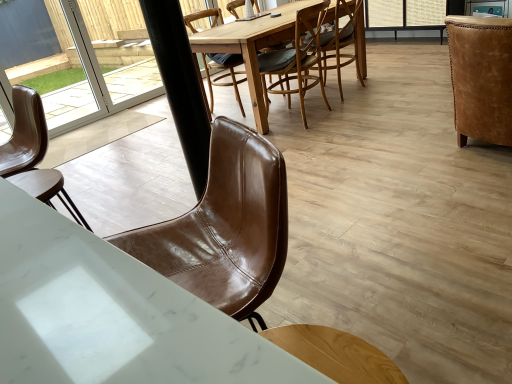
What is the approximate width of leather armchair at right, placed as the 5th chair when sorted from left to right?

leather armchair at right, placed as the 5th chair when sorted from left to right, is 36.98 inches wide.

I want to click on wooden round table at center, so click(x=250, y=48).

The image size is (512, 384). What do you see at coordinates (75, 85) in the screenshot? I see `transparent glass door at upper left` at bounding box center [75, 85].

Where is `transparent glass door at upper left`? transparent glass door at upper left is located at coordinates (75, 85).

Locate an element on the screen. brown leather chair at center, arranged as the third chair when viewed from the right is located at coordinates (297, 60).

From a real-world perspective, is white marble desk at lower left under brown leather chair at center, arranged as the 3th chair when viewed from the left?

Incorrect, from a real-world perspective, white marble desk at lower left is higher than brown leather chair at center, arranged as the 3th chair when viewed from the left.

Is point (221, 355) in front of point (283, 92)?

Yes, point (221, 355) is in front of point (283, 92).

Considering the sizes of white marble desk at lower left and brown leather chair at center, arranged as the third chair when viewed from the right, in the image, is white marble desk at lower left taller or shorter than brown leather chair at center, arranged as the third chair when viewed from the right,?

In the image, white marble desk at lower left appears to be shorter than brown leather chair at center, arranged as the third chair when viewed from the right.

Are white marble desk at lower left and brown leather chair at center, arranged as the third chair when viewed from the right, far apart?

Absolutely, white marble desk at lower left is distant from brown leather chair at center, arranged as the third chair when viewed from the right.

Is black matte pole at center positioned beyond the bounds of white marble desk at lower left?

Yes, black matte pole at center is not within white marble desk at lower left.

Is black matte pole at center positioned with its back to white marble desk at lower left?

No, black matte pole at center is not facing the opposite direction of white marble desk at lower left.

Measure the distance between black matte pole at center and white marble desk at lower left.

black matte pole at center is 3.52 feet from white marble desk at lower left.

In terms of size, does leather armchair at right, placed as the 5th chair when sorted from left to right, appear bigger or smaller than wooden round table at center?

leather armchair at right, placed as the 5th chair when sorted from left to right, is smaller than wooden round table at center.

Is leather armchair at right, the 1th chair viewed from the right, completely or partially outside of wooden round table at center?

leather armchair at right, the 1th chair viewed from the right, lies outside wooden round table at center's area.

Relative to wooden round table at center, is leather armchair at right, the 1th chair viewed from the right, in front or behind?

leather armchair at right, the 1th chair viewed from the right, is positioned closer to the viewer than wooden round table at center.

Locate an element on the screen. chair that is the 3rd object to the right of the wooden round table at center, starting at the anchor is located at coordinates (481, 78).

Is wooden round table at center at the back of brown leather chair at center, arranged as the 3th chair when viewed from the left?

brown leather chair at center, arranged as the 3th chair when viewed from the left, is not turned away from wooden round table at center.

Could wooden round table at center be considered to be inside brown leather chair at center, arranged as the third chair when viewed from the right?

No, wooden round table at center is not inside brown leather chair at center, arranged as the third chair when viewed from the right.

Are brown leather chair at center, arranged as the 3th chair when viewed from the left, and wooden round table at center beside each other?

brown leather chair at center, arranged as the 3th chair when viewed from the left, is not next to wooden round table at center, and they're not touching.

Considering the relative sizes of brown leather chair at center, arranged as the 3th chair when viewed from the left, and wooden round table at center in the image provided, is brown leather chair at center, arranged as the 3th chair when viewed from the left, shorter than wooden round table at center?

Incorrect, the height of brown leather chair at center, arranged as the 3th chair when viewed from the left, does not fall short of that of wooden round table at center.

From a real-world perspective, which object stands above the other?

From a 3D spatial view, white marble desk at lower left is above.

Is white marble desk at lower left oriented away from wooden round table at center?

No, wooden round table at center is not at the back of white marble desk at lower left.

Which object is thinner, white marble desk at lower left or wooden round table at center?

With smaller width is white marble desk at lower left.

Is leather armchair at right, the 1th chair viewed from the right, wider or thinner than brown leather chair at left, arranged as the first chair when viewed from the left?

Clearly, leather armchair at right, the 1th chair viewed from the right, has more width compared to brown leather chair at left, arranged as the first chair when viewed from the left.

Is leather armchair at right, the 1th chair viewed from the right, not close to brown leather chair at left, placed as the 5th chair when sorted from right to left?

Indeed, leather armchair at right, the 1th chair viewed from the right, is not near brown leather chair at left, placed as the 5th chair when sorted from right to left.

Is leather armchair at right, the 1th chair viewed from the right, taller than brown leather chair at left, placed as the 5th chair when sorted from right to left?

In fact, leather armchair at right, the 1th chair viewed from the right, may be shorter than brown leather chair at left, placed as the 5th chair when sorted from right to left.

Starting from the brown leather chair at left, arranged as the first chair when viewed from the left, which chair is the 4th one to the right? Please provide its 2D coordinates.

[(481, 78)]

From the picture: From a real-world perspective, which object stands above the other?

white marble desk at lower left is physically above.

Does light brown leather chair at center, arranged as the second chair when viewed from the right, appear on the right side of white marble desk at lower left?

Yes, light brown leather chair at center, arranged as the second chair when viewed from the right, is to the right of white marble desk at lower left.

Which is behind, point (352, 23) or point (160, 345)?

The point (352, 23) is farther from the camera.

Between light brown leather chair at center, arranged as the second chair when viewed from the right, and white marble desk at lower left, which one has larger width?

With larger width is light brown leather chair at center, arranged as the second chair when viewed from the right.

Find the location of a particular element. Image resolution: width=512 pixels, height=384 pixels. chair that is the 3rd object located above the white marble desk at lower left (from the image's perspective) is located at coordinates (297, 60).

Identify the location of desk located underneath the black matte pole at center (from a real-world perspective). The image size is (512, 384). (112, 314).

When comparing their distances from brown leather chair at center, arranged as the third chair when viewed from the right, does light brown leather chair at center, the 4th chair from the left, or transparent glass door at upper left seem further?

transparent glass door at upper left is further to brown leather chair at center, arranged as the third chair when viewed from the right.

When comparing their distances from black matte pole at center, does leather armchair at right, placed as the 5th chair when sorted from left to right, or light brown leather chair at center, arranged as the second chair when viewed from the right, seem further?

The object further to black matte pole at center is light brown leather chair at center, arranged as the second chair when viewed from the right.

When comparing their distances from brown leather chair at center, arranged as the 3th chair when viewed from the left, does brown leather chair at left, arranged as the first chair when viewed from the left, or white marble desk at lower left seem further?

Among the two, white marble desk at lower left is located further to brown leather chair at center, arranged as the 3th chair when viewed from the left.

Estimate the real-world distances between objects in this image. Which object is further from leather armchair at right, the 1th chair viewed from the right, white marble desk at lower left or brown leather chair at left, arranged as the first chair when viewed from the left?

white marble desk at lower left is positioned further to the anchor leather armchair at right, the 1th chair viewed from the right.

Which object lies nearer to the anchor point wooden round table at center, black matte pole at center or brown leather chair at center, the second chair from the left?

Based on the image, brown leather chair at center, the second chair from the left, appears to be nearer to wooden round table at center.

Estimate the real-world distances between objects in this image. Which object is closer to white marble desk at lower left, transparent glass door at upper left or wooden round table at center?

wooden round table at center is positioned closer to the anchor white marble desk at lower left.

Which object lies further to the anchor point white marble desk at lower left, brown leather chair at left, placed as the 5th chair when sorted from right to left, or brown leather chair at center, positioned as the 4th chair in right-to-left order?

brown leather chair at center, positioned as the 4th chair in right-to-left order, is positioned further to the anchor white marble desk at lower left.

Which object lies nearer to the anchor point brown leather chair at left, placed as the 5th chair when sorted from right to left, black matte pole at center or wooden round table at center?

black matte pole at center.

Locate an element on the screen. The height and width of the screenshot is (384, 512). pole situated between brown leather chair at left, placed as the 5th chair when sorted from right to left, and leather armchair at right, the 1th chair viewed from the right, from left to right is located at coordinates (180, 84).

Where is `chair located between brown leather chair at center, arranged as the 3th chair when viewed from the left, and brown leather chair at center, the second chair from the left, in the depth direction`? The width and height of the screenshot is (512, 384). chair located between brown leather chair at center, arranged as the 3th chair when viewed from the left, and brown leather chair at center, the second chair from the left, in the depth direction is located at coordinates (341, 41).

Where is `glass door located between black matte pole at center and brown leather chair at center, positioned as the 4th chair in right-to-left order, in the depth direction`? The height and width of the screenshot is (384, 512). glass door located between black matte pole at center and brown leather chair at center, positioned as the 4th chair in right-to-left order, in the depth direction is located at coordinates [x=75, y=85].

This screenshot has width=512, height=384. Identify the location of round table positioned between black matte pole at center and brown leather chair at center, the second chair from the left, from near to far. (250, 48).